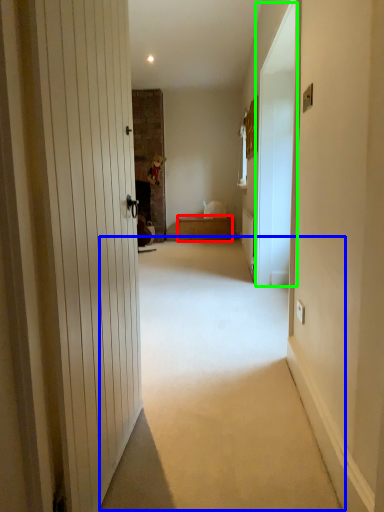
Question: Estimate the real-world distances between objects in this image. Which object is closer to furniture (highlighted by a red box), corridor (highlighted by a blue box) or screen door (highlighted by a green box)?

Choices:
 (A) corridor
 (B) screen door

Answer: (B)